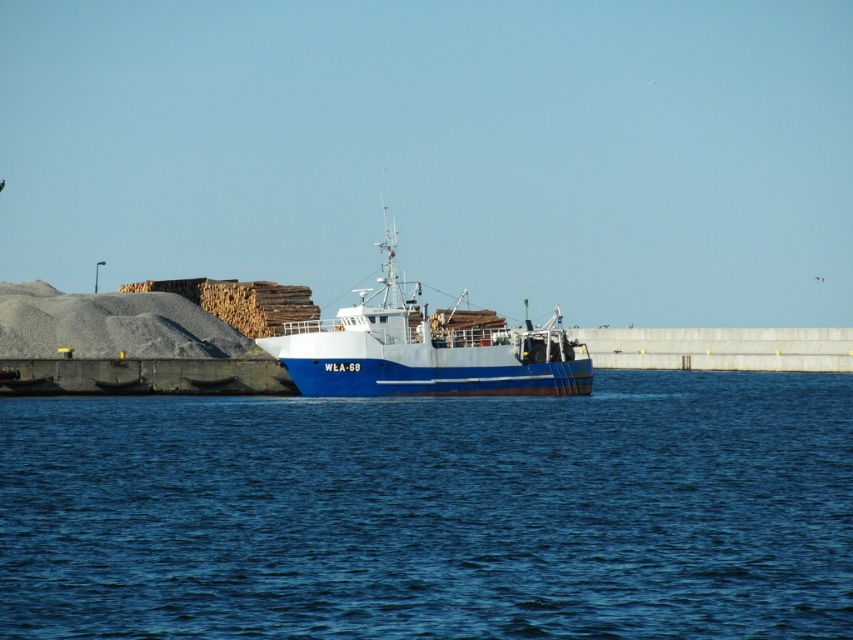
Does blue water at center have a smaller size compared to blue matte boat at center?

Yes, blue water at center is smaller than blue matte boat at center.

Can you confirm if blue water at center is bigger than blue matte boat at center?

Actually, blue water at center might be smaller than blue matte boat at center.

Between point (405, 561) and point (350, 342), which one is positioned behind?

The point (350, 342) is more distant.

Identify the location of blue water at center. The image size is (853, 640). (434, 513).